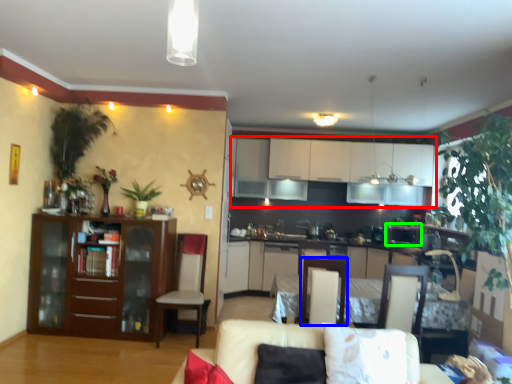
Question: Based on their relative distances, which object is farther from cabinetry (highlighted by a red box)? Choose from armchair (highlighted by a blue box) and appliance (highlighted by a green box).

Choices:
 (A) armchair
 (B) appliance

Answer: (A)